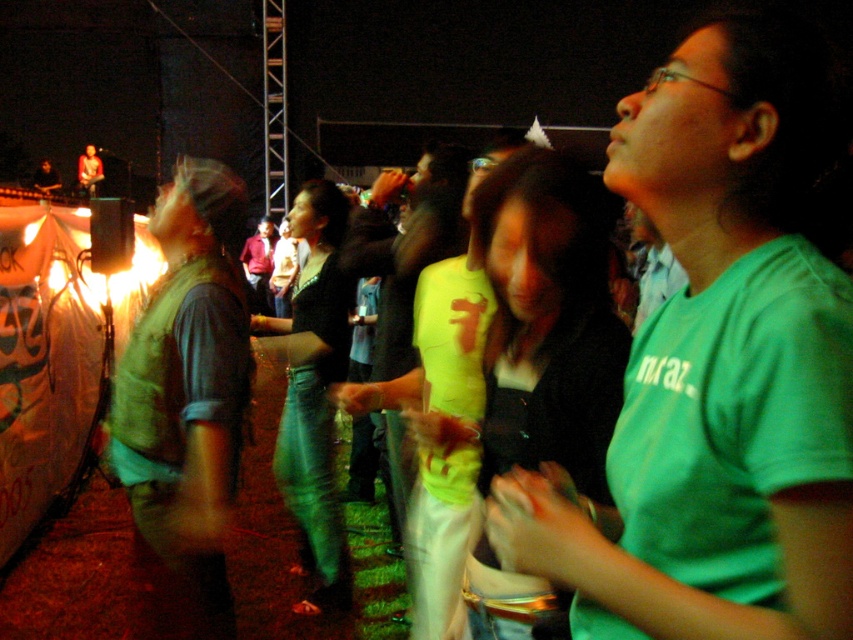
You are standing at the point labeled point [730,264] and want to walk to the point labeled point [312,492]. Which direction should you move in to get closer to your destination?

To move from point [730,264] to point [312,492], you should move towards the right and upwards since point [312,492] is located to the right and above point [730,264].

You are standing at the point labeled as point (202,182) and want to move to the stage in the background. Is the point labeled as point (614,547) in front of or behind you in your path towards the stage?

The point labeled as point (614,547) is closer to the viewer than point (202,182), so it is in front of you in your path towards the stage.